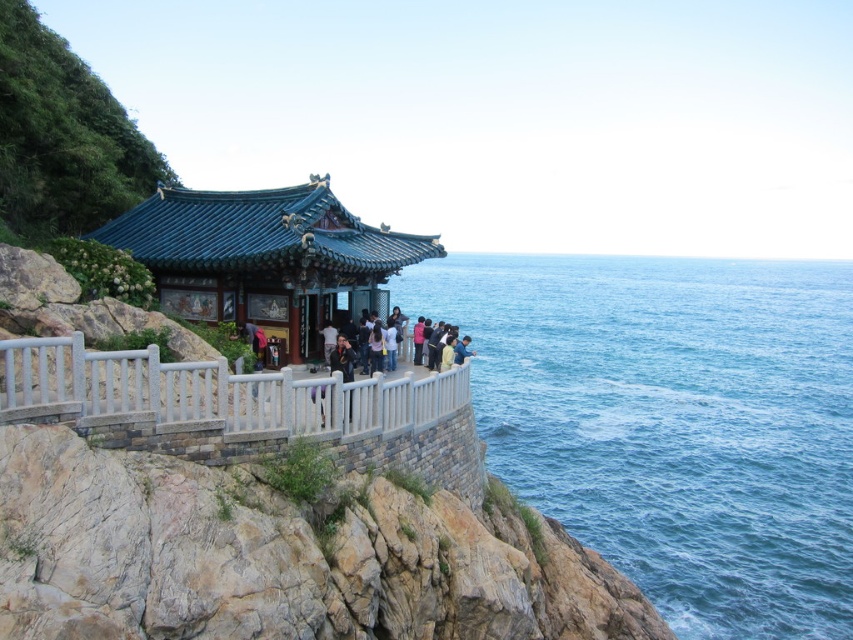
Between point (715, 627) and point (332, 368), which one is positioned in front?

Point (332, 368)

At what (x,y) coordinates should I click in order to perform the action: click on blue water at center. Please return your answer as a coordinate pair (x, y). The image size is (853, 640). Looking at the image, I should click on (672, 420).

Locate an element on the screen. The image size is (853, 640). green glazed tile gazebo at center is located at coordinates (264, 257).

The height and width of the screenshot is (640, 853). I want to click on green glazed tile gazebo at center, so click(x=264, y=257).

The width and height of the screenshot is (853, 640). I want to click on green glazed tile gazebo at center, so click(264, 257).

Does point (399, 300) come farther from viewer compared to point (195, 260)?

Yes, point (399, 300) is behind point (195, 260).

The image size is (853, 640). Find the location of `blue water at center`. blue water at center is located at coordinates (672, 420).